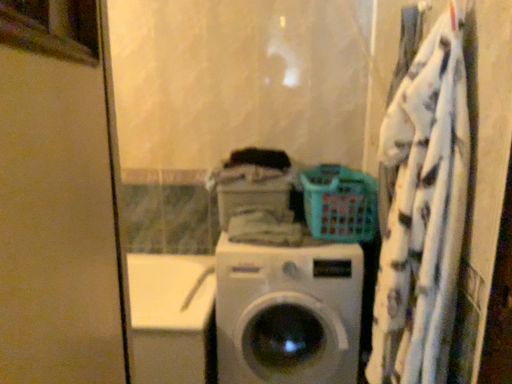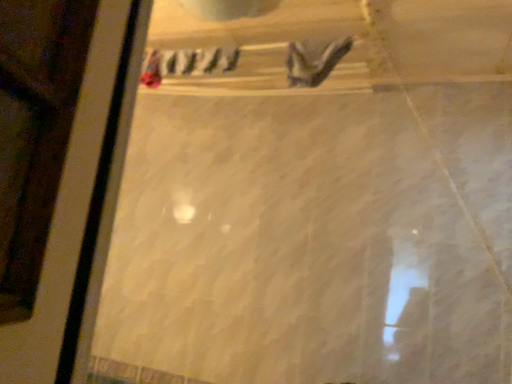
Question: Which way did the camera rotate in the video?

Choices:
 (A) rotated left
 (B) rotated right

Answer: (A)